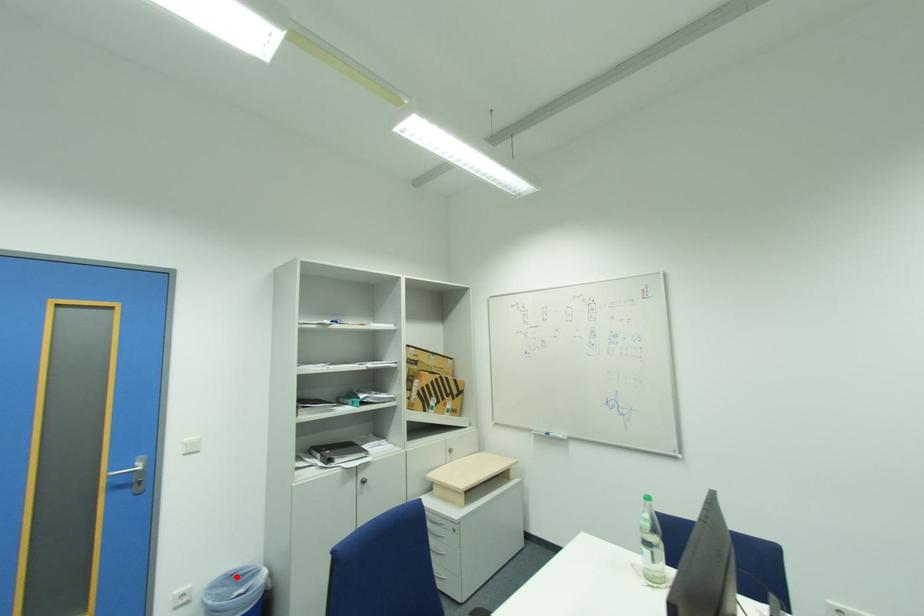
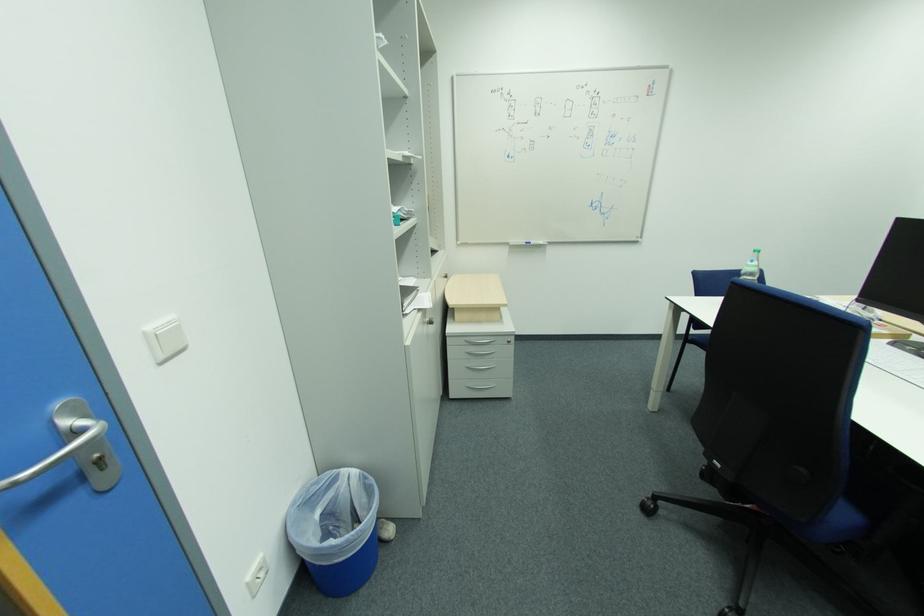
Question: I am providing you with two images of the same scene from different viewpoints. A red point is shown in image1. For the corresponding object point in image2, is it positioned nearer or farther from the camera?

Choices:
 (A) Nearer
 (B) Farther

Answer: (B)